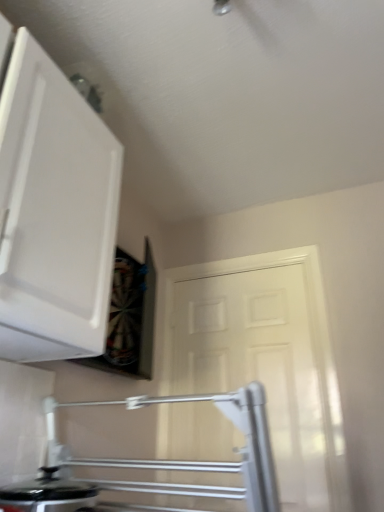
Question: From a real-world perspective, relative to black glossy pot at lower left, is white matte door at center vertically above or below?

Choices:
 (A) above
 (B) below

Answer: (A)

Question: From the image's perspective, is white matte door at center positioned above or below black glossy pot at lower left?

Choices:
 (A) below
 (B) above

Answer: (B)

Question: Based on their relative distances, which object is nearer to the white matte cabinet at upper left?

Choices:
 (A) black glossy pot at lower left
 (B) white matte door at center

Answer: (A)

Question: Estimate the real-world distances between objects in this image. Which object is farther from the black glossy pot at lower left?

Choices:
 (A) white matte cabinet at upper left
 (B) white matte door at center

Answer: (B)